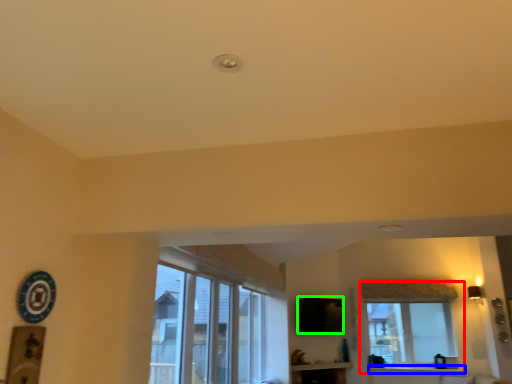
Question: Considering the real-world distances, which object is closest to window (highlighted by a red box)? window sill (highlighted by a blue box) or window screen (highlighted by a green box).

Choices:
 (A) window sill
 (B) window screen

Answer: (A)